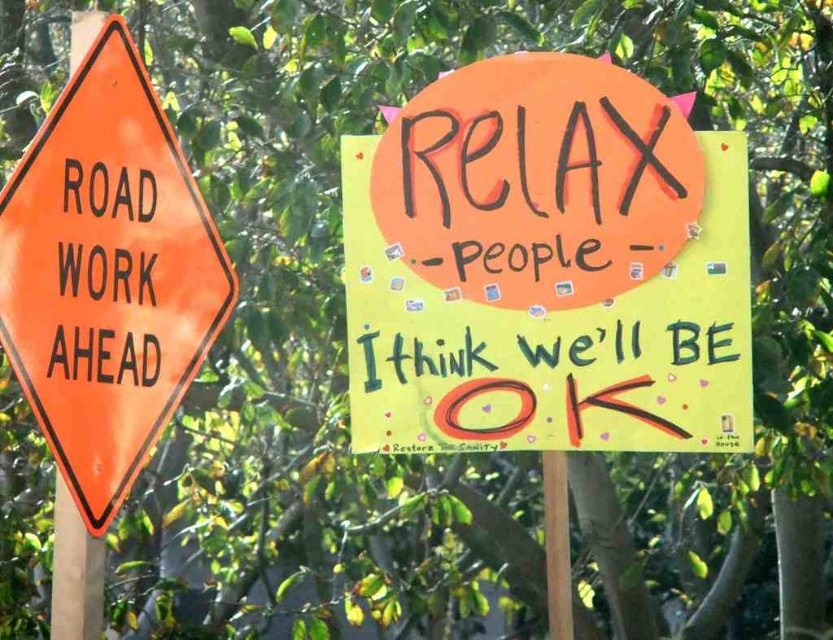
Question: Which object is the closest to the orange plastic signpost at left?

Choices:
 (A) yellow paper poster at upper right
 (B) green painted text at center

Answer: (B)

Question: Which point is farther from the camera taking this photo?

Choices:
 (A) (53, 636)
 (B) (732, 138)

Answer: (B)

Question: Is yellow paper poster at upper right smaller than orange reflective road sign at left?

Choices:
 (A) yes
 (B) no

Answer: (B)

Question: Is orange reflective diamond-shaped road work ahead sign at left thinner than green painted text at center?

Choices:
 (A) yes
 (B) no

Answer: (A)

Question: Does orange reflective diamond-shaped road work ahead sign at left appear on the right side of orange plastic signpost at left?

Choices:
 (A) yes
 (B) no

Answer: (A)

Question: Which of the following is the closest to the observer?

Choices:
 (A) (82, 132)
 (B) (495, 152)
 (C) (457, 339)

Answer: (A)